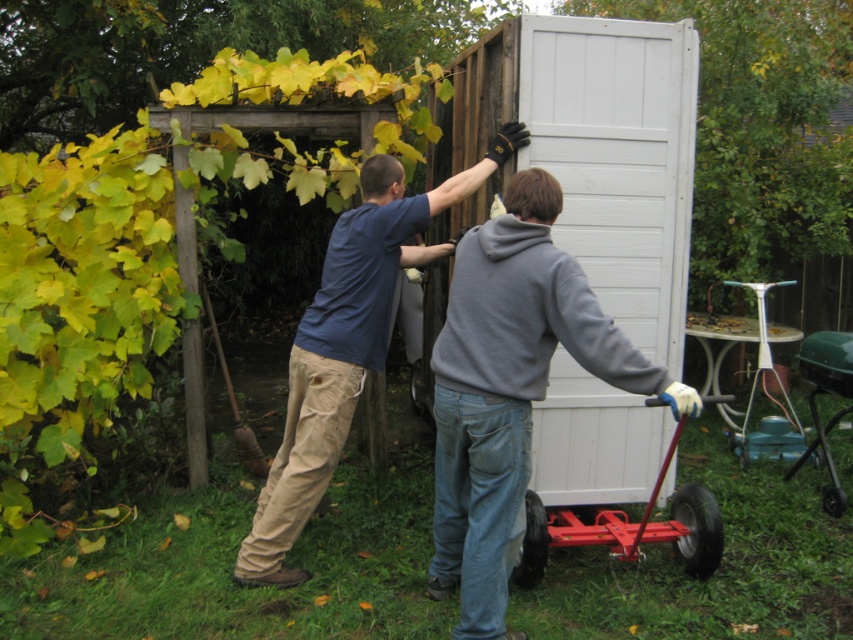
You are standing in the backyard and see two points marked on the ground. The first point is at coordinates point (x=566, y=337) and the second is at point (x=343, y=368). Which point is closer to you?

Point (x=566, y=337) is closer to the viewer than point (x=343, y=368).

You are a photographer trying to capture both the gray fleece hoodie at center and the blue cotton shirt at center in a single frame. Which clothing item would you need to adjust your focus on to ensure it takes up more of the photo?

The gray fleece hoodie at center occupies less space than the blue cotton shirt at center, so you should adjust your focus on the gray fleece hoodie at center to make it larger in the photo.